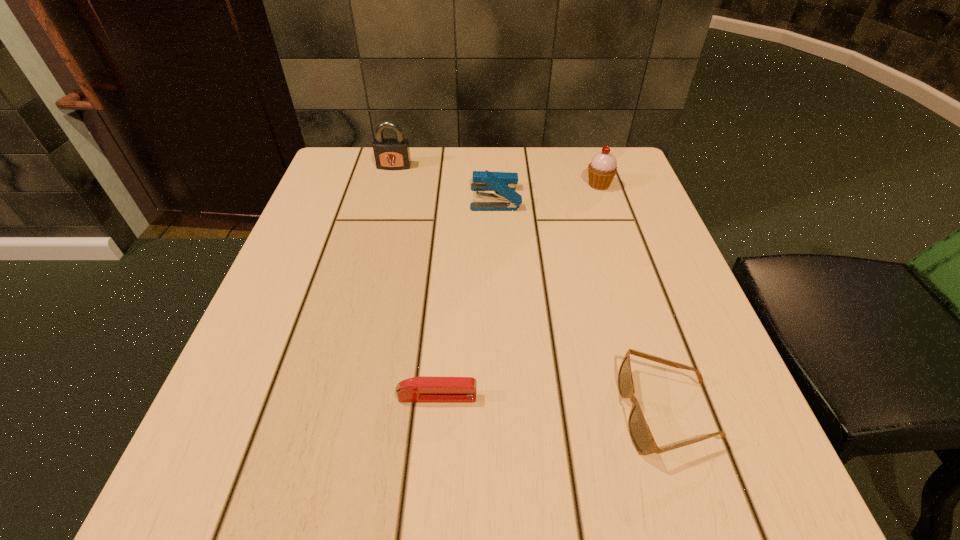
The image size is (960, 540). In order to click on vacant space that satisfies the following two spatial constraints: 1. on the front side of the farther stapler; 2. on the front-facing side of the nearer stapler in this screenshot , I will do `click(504, 397)`.

Identify the location of vacant region that satisfies the following two spatial constraints: 1. on the front side of the cupcake; 2. on the frames of the second shortest object. Image resolution: width=960 pixels, height=540 pixels. [677, 412].